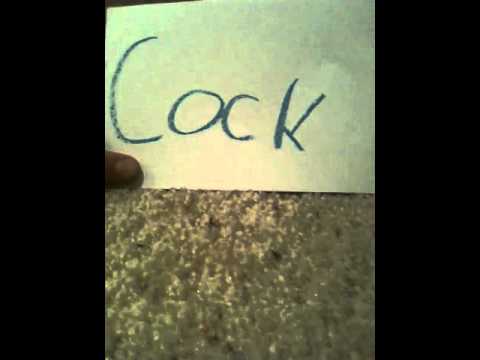
At what (x,y) coordinates should I click in order to perform the action: click on table. Please return your answer as a coordinate pair (x, y). This screenshot has height=360, width=480. Looking at the image, I should click on (316, 269).